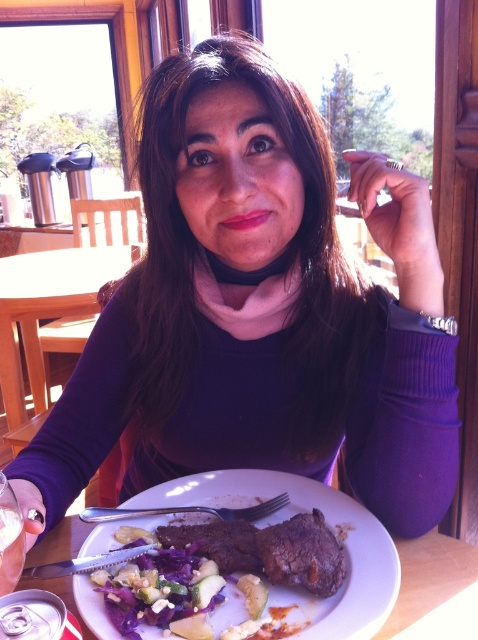
Can you confirm if dark brown steak at plate center is positioned to the right of silver metallic fork at plate center?

Indeed, dark brown steak at plate center is positioned on the right side of silver metallic fork at plate center.

Is dark brown steak at plate center above silver metallic fork at plate center?

Actually, dark brown steak at plate center is below silver metallic fork at plate center.

Is point (323, 595) more distant than point (217, 509)?

No.

Identify the location of dark brown steak at plate center. The height and width of the screenshot is (640, 478). (302, 554).

Does matte brown steak at center appear on the right side of silver metallic fork at plate center?

Indeed, matte brown steak at center is positioned on the right side of silver metallic fork at plate center.

Is matte brown steak at center behind silver metallic fork at plate center?

No, matte brown steak at center is in front of silver metallic fork at plate center.

Is point (337, 497) in front of point (84, 520)?

No, it is behind (84, 520).

Locate an element on the screen. The height and width of the screenshot is (640, 478). matte brown steak at center is located at coordinates (327, 525).

Is shiny purple salad at plate center positioned behind wooden table at center?

That is False.

Is shiny purple salad at plate center taller than wooden table at center?

No, shiny purple salad at plate center is not taller than wooden table at center.

Image resolution: width=478 pixels, height=640 pixels. What do you see at coordinates (177, 580) in the screenshot? I see `shiny purple salad at plate center` at bounding box center [177, 580].

You are a GUI agent. You are given a task and a screenshot of the screen. Output one action in this format:
    pyautogui.click(x=<x>, y=<y>)
    Task: Click on the shiny purple salad at plate center
    
    Given the screenshot: What is the action you would take?
    pyautogui.click(x=177, y=580)